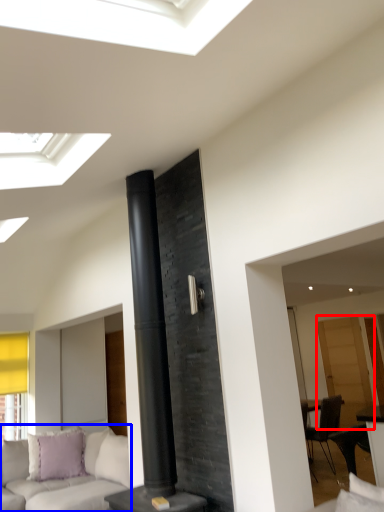
Question: Which object is further to the camera taking this photo, glass door (highlighted by a red box) or studio couch (highlighted by a blue box)?

Choices:
 (A) glass door
 (B) studio couch

Answer: (A)